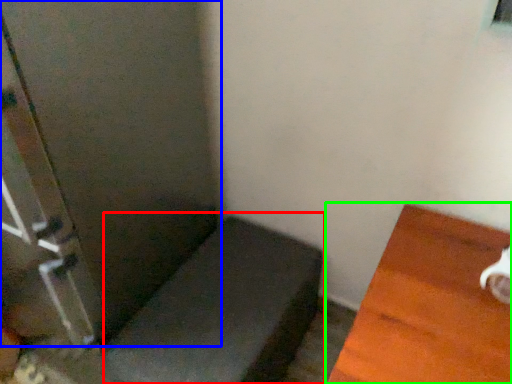
Question: Considering the real-world distances, which object is farthest from furniture (highlighted by a red box)? screen door (highlighted by a blue box) or furniture (highlighted by a green box)?

Choices:
 (A) screen door
 (B) furniture

Answer: (B)